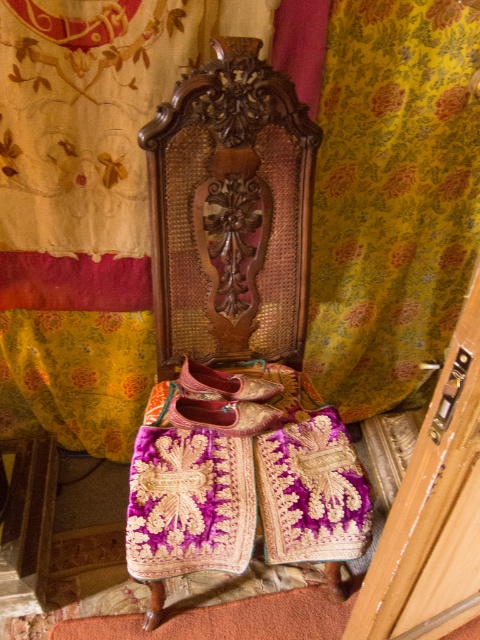
From the picture: Is yellow floral fabric at upper center thinner than purple velvet shoe at center?

Incorrect, yellow floral fabric at upper center's width is not less than purple velvet shoe at center's.

The height and width of the screenshot is (640, 480). I want to click on yellow floral fabric at upper center, so click(x=146, y=195).

Where is `yellow floral fabric at upper center`? Image resolution: width=480 pixels, height=640 pixels. yellow floral fabric at upper center is located at coordinates (146, 195).

Is purple velvet shoe at center to the right of leather/embossed shoe at center from the viewer's perspective?

Incorrect, purple velvet shoe at center is not on the right side of leather/embossed shoe at center.

Which is in front, point (172, 419) or point (200, 365)?

Point (172, 419)

Identify the location of purple velvet shoe at center. The height and width of the screenshot is (640, 480). click(222, 413).

Which is below, yellow floral fabric at upper center or dark wood carved headboard at center?

yellow floral fabric at upper center is lower down.

The image size is (480, 640). What do you see at coordinates (146, 195) in the screenshot? I see `yellow floral fabric at upper center` at bounding box center [146, 195].

Locate an element on the screen. yellow floral fabric at upper center is located at coordinates (146, 195).